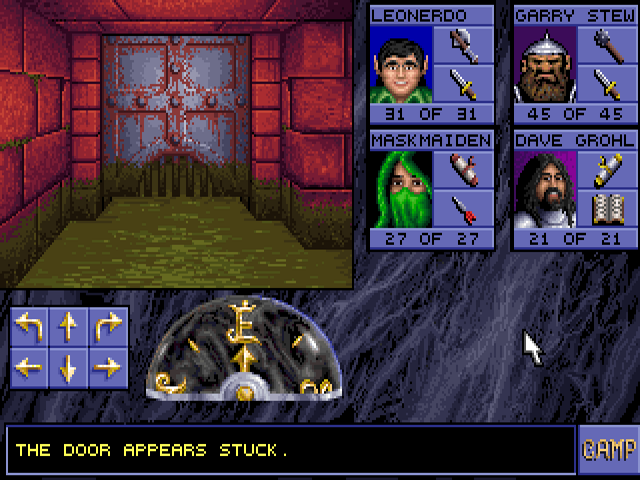
Find the location of a particular element. This screenshot has width=640, height=480. metal and red door is located at coordinates (178, 111).